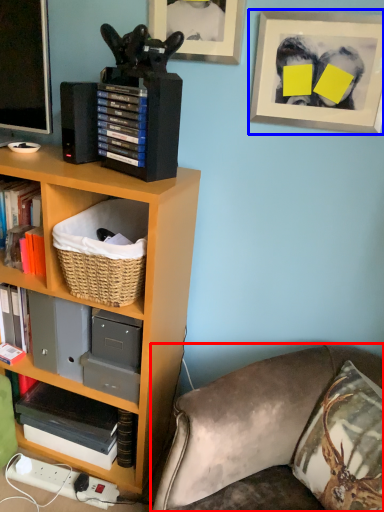
Question: Which point is closer to the camera, studio couch (highlighted by a red box) or picture frame (highlighted by a blue box)?

Choices:
 (A) studio couch
 (B) picture frame

Answer: (A)